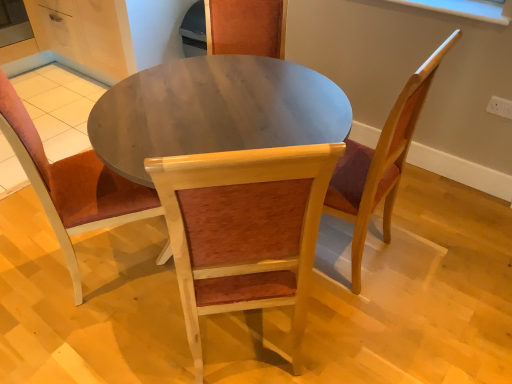
The width and height of the screenshot is (512, 384). Identify the location of free space to the left of wooden chair at center, which appears as the 2th chair when viewed from the left. (112, 342).